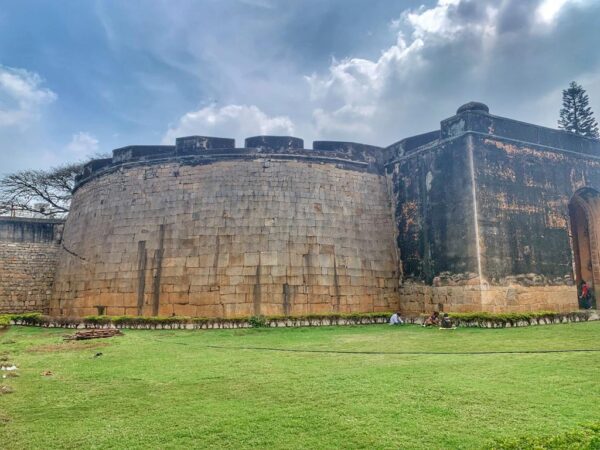
Where is `archway`? The width and height of the screenshot is (600, 450). archway is located at coordinates (579, 238).